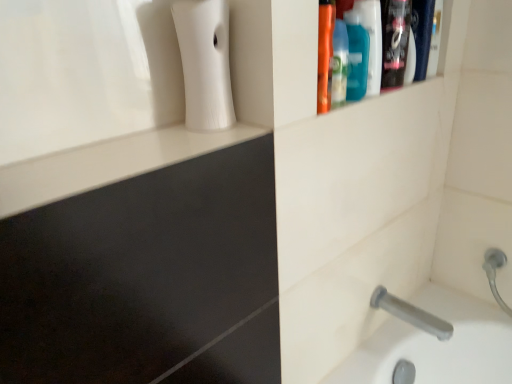
Question: Is white matte soap dispenser at upper left at the left side of translucent plastic mouthwash at upper right, the second mouthwash from the right?

Choices:
 (A) yes
 (B) no

Answer: (A)

Question: Can you confirm if white matte soap dispenser at upper left is smaller than translucent plastic mouthwash at upper right, acting as the 1th mouthwash starting from the left?

Choices:
 (A) yes
 (B) no

Answer: (B)

Question: Can you confirm if white matte soap dispenser at upper left is taller than translucent plastic mouthwash at upper right, acting as the 1th mouthwash starting from the left?

Choices:
 (A) yes
 (B) no

Answer: (A)

Question: Is white matte soap dispenser at upper left wider than translucent plastic mouthwash at upper right, acting as the 1th mouthwash starting from the left?

Choices:
 (A) yes
 (B) no

Answer: (A)

Question: Are white matte soap dispenser at upper left and translucent plastic mouthwash at upper right, the second mouthwash from the right, far apart?

Choices:
 (A) no
 (B) yes

Answer: (A)

Question: In terms of size, does teal plastic mouthwash at upper right, which is counted as the 2th mouthwash, starting from the left, appear bigger or smaller than translucent plastic mouthwash at upper right, the second mouthwash from the right?

Choices:
 (A) big
 (B) small

Answer: (A)

Question: Considering the positions of teal plastic mouthwash at upper right, positioned as the first mouthwash in right-to-left order, and translucent plastic mouthwash at upper right, acting as the 1th mouthwash starting from the left, in the image, is teal plastic mouthwash at upper right, positioned as the first mouthwash in right-to-left order, taller or shorter than translucent plastic mouthwash at upper right, acting as the 1th mouthwash starting from the left,?

Choices:
 (A) tall
 (B) short

Answer: (A)

Question: Does point (375, 36) appear closer or farther from the camera than point (345, 21)?

Choices:
 (A) closer
 (B) farther

Answer: (B)

Question: Would you say teal plastic mouthwash at upper right, which is counted as the 2th mouthwash, starting from the left, is to the left or to the right of translucent plastic mouthwash at upper right, the second mouthwash from the right, in the picture?

Choices:
 (A) right
 (B) left

Answer: (A)

Question: Would you say white matte soap dispenser at upper left is inside or outside gray matte tap at lower right?

Choices:
 (A) inside
 (B) outside

Answer: (B)

Question: From a real-world perspective, is white matte soap dispenser at upper left above or below gray matte tap at lower right?

Choices:
 (A) below
 (B) above

Answer: (B)

Question: Is point (189, 49) positioned closer to the camera than point (402, 301)?

Choices:
 (A) closer
 (B) farther

Answer: (A)

Question: In the image, is white matte soap dispenser at upper left positioned in front of or behind gray matte tap at lower right?

Choices:
 (A) front
 (B) behind

Answer: (A)

Question: From a real-world perspective, relative to translucent plastic mouthwash at upper right, the second mouthwash from the right, is gray matte tap at lower right vertically above or below?

Choices:
 (A) below
 (B) above

Answer: (A)

Question: Is gray matte tap at lower right in front of or behind translucent plastic mouthwash at upper right, the second mouthwash from the right, in the image?

Choices:
 (A) behind
 (B) front

Answer: (A)